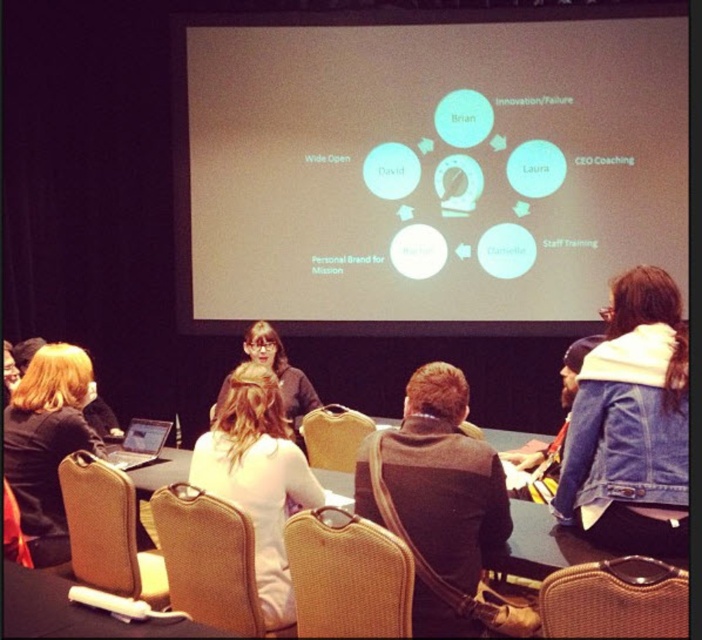
Can you confirm if denim jacket at lower right is wider than matte black jacket at lower left?

In fact, denim jacket at lower right might be narrower than matte black jacket at lower left.

Image resolution: width=702 pixels, height=640 pixels. What are the coordinates of `denim jacket at lower right` in the screenshot? It's located at (630, 426).

Identify the location of denim jacket at lower right. (630, 426).

The width and height of the screenshot is (702, 640). Find the location of `denim jacket at lower right`. denim jacket at lower right is located at coordinates (630, 426).

Does white matte projection screen at upper center appear over braided wood chair at lower right?

Yes, white matte projection screen at upper center is above braided wood chair at lower right.

Does point (399, 221) lie behind point (578, 579)?

Yes, it is.

Where is `white matte projection screen at upper center`? The width and height of the screenshot is (702, 640). white matte projection screen at upper center is located at coordinates (425, 166).

The height and width of the screenshot is (640, 702). What do you see at coordinates (258, 477) in the screenshot? I see `white fabric shirt at center` at bounding box center [258, 477].

Does white fabric shirt at center have a lesser width compared to silver metallic laptop at lower left?

Incorrect, white fabric shirt at center's width is not less than silver metallic laptop at lower left's.

Between point (298, 452) and point (168, 429), which one is positioned in front?

Point (298, 452)

This screenshot has height=640, width=702. In order to click on white fabric shirt at center in this screenshot , I will do `click(258, 477)`.